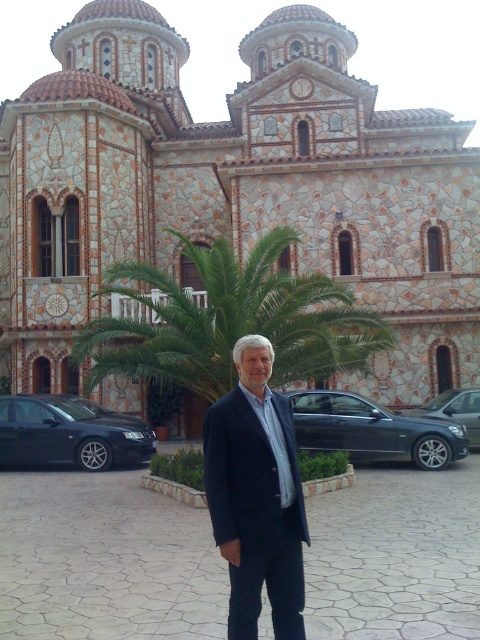
Question: Which object is positioned closest to the stone mosaic church at center?

Choices:
 (A) sleek metallic sedan at center
 (B) satin black sedan at center

Answer: (B)

Question: Which point is closer to the camera taking this photo?

Choices:
 (A) (288, 556)
 (B) (132, 428)
 (C) (254, 140)

Answer: (A)

Question: Which object is closer to the camera taking this photo?

Choices:
 (A) sleek metallic sedan at center
 (B) stone mosaic church at center
 (C) shiny black sedan at lower left
 (D) satin black sedan at center

Answer: (D)

Question: Does green leafy palm tree at center appear under sleek metallic sedan at center?

Choices:
 (A) no
 (B) yes

Answer: (A)

Question: Does shiny black sedan at lower left come in front of sleek metallic sedan at center?

Choices:
 (A) yes
 (B) no

Answer: (A)

Question: Can you confirm if green leafy palm tree at center is positioned below dark blue suit at center?

Choices:
 (A) no
 (B) yes

Answer: (A)